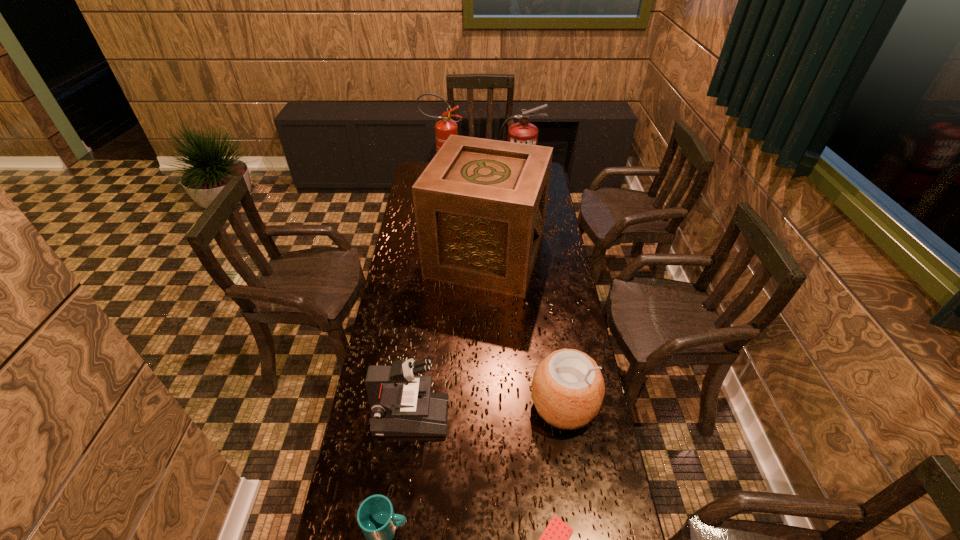
I want to click on object present at the far edge, so click(x=444, y=128).

Locate an element on the screen. The height and width of the screenshot is (540, 960). fire extinguisher that is at the left edge is located at coordinates (444, 128).

Image resolution: width=960 pixels, height=540 pixels. I want to click on box that is at the left edge, so click(x=480, y=205).

At what (x,y) coordinates should I click in order to perform the action: click on microscope positioned at the left edge. Please return your answer as a coordinate pair (x, y). Looking at the image, I should click on (402, 404).

Identify the location of fire extinguisher that is positioned at the right edge. (523, 132).

Identify the location of box at the right edge. The height and width of the screenshot is (540, 960). (480, 205).

The height and width of the screenshot is (540, 960). Find the location of `coconut positioned at the right edge`. coconut positioned at the right edge is located at coordinates (567, 389).

This screenshot has height=540, width=960. Identify the location of object positioned at the far left corner. (444, 128).

I want to click on vacant space at the left edge of the desktop, so click(x=396, y=276).

Where is `vacant space at the right edge`? This screenshot has height=540, width=960. vacant space at the right edge is located at coordinates (575, 446).